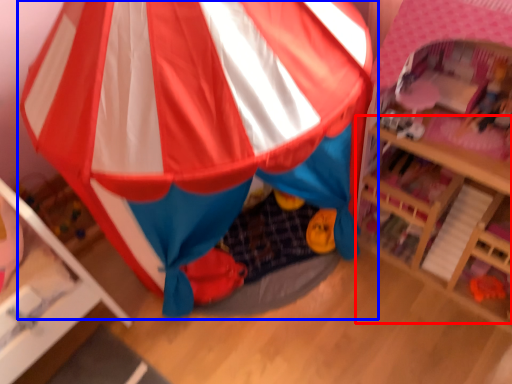
Question: Which object is closer to the camera taking this photo, table (highlighted by a red box) or tent (highlighted by a blue box)?

Choices:
 (A) table
 (B) tent

Answer: (B)